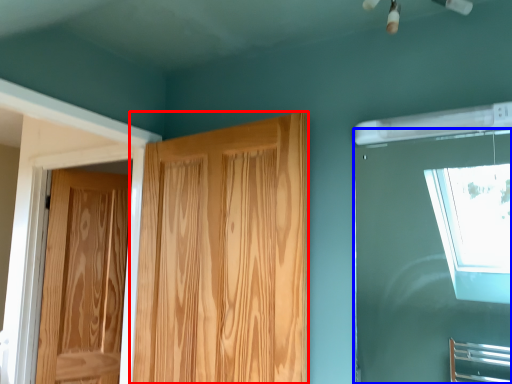
Question: Which object is closer to the camera taking this photo, door (highlighted by a red box) or window (highlighted by a blue box)?

Choices:
 (A) door
 (B) window

Answer: (B)